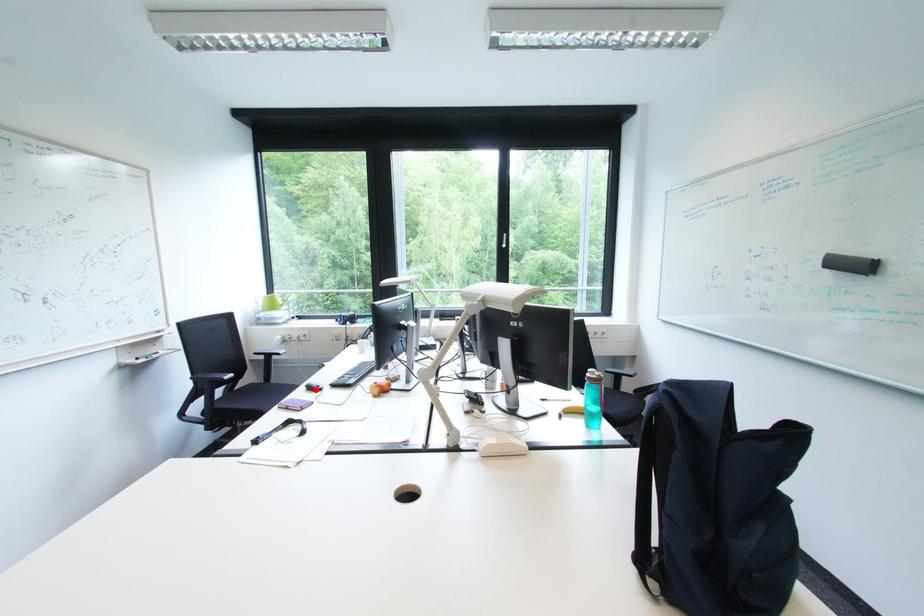
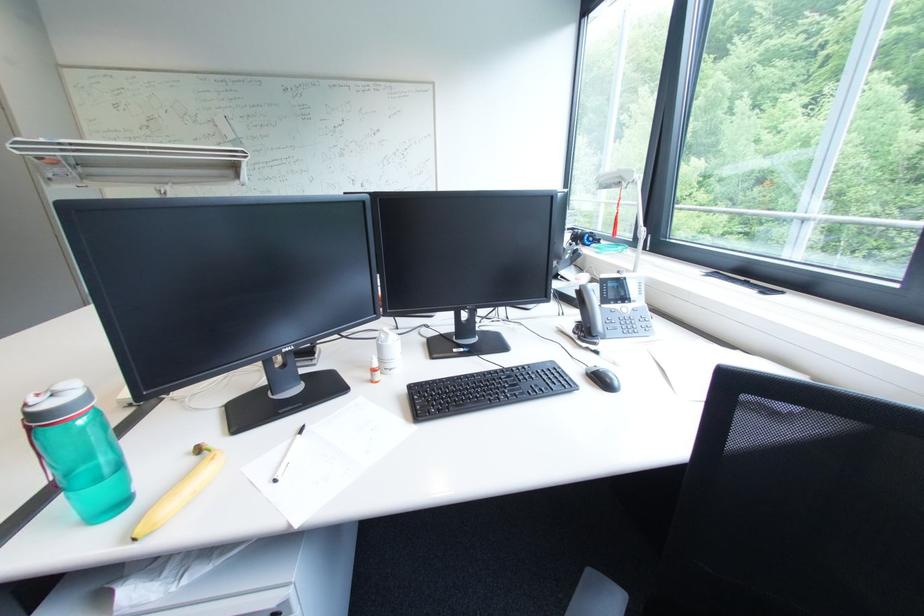
Question: I am providing you with two images of the same scene from different viewpoints. A red point is marked on the first image. Is the red point's position out of view in image 2?

Choices:
 (A) Yes
 (B) No

Answer: (A)